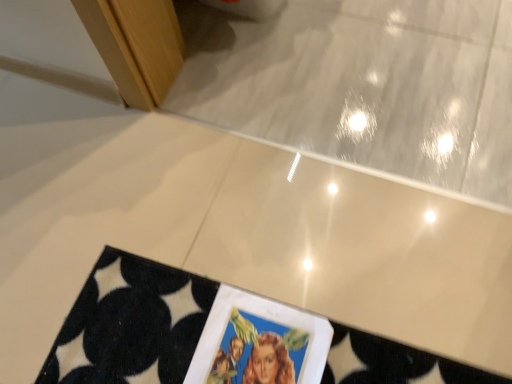
Image resolution: width=512 pixels, height=384 pixels. Identify the location of vacant space underneath white glossy tablet at center (from a real-world perspective). pos(257,351).